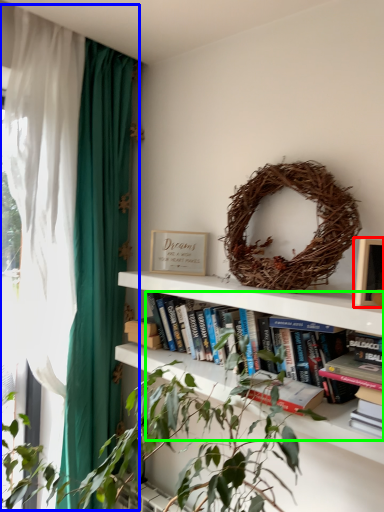
Question: Which is nearer to the picture frame (highlighted by a red box)? curtain (highlighted by a blue box) or book (highlighted by a green box).

Choices:
 (A) curtain
 (B) book

Answer: (B)